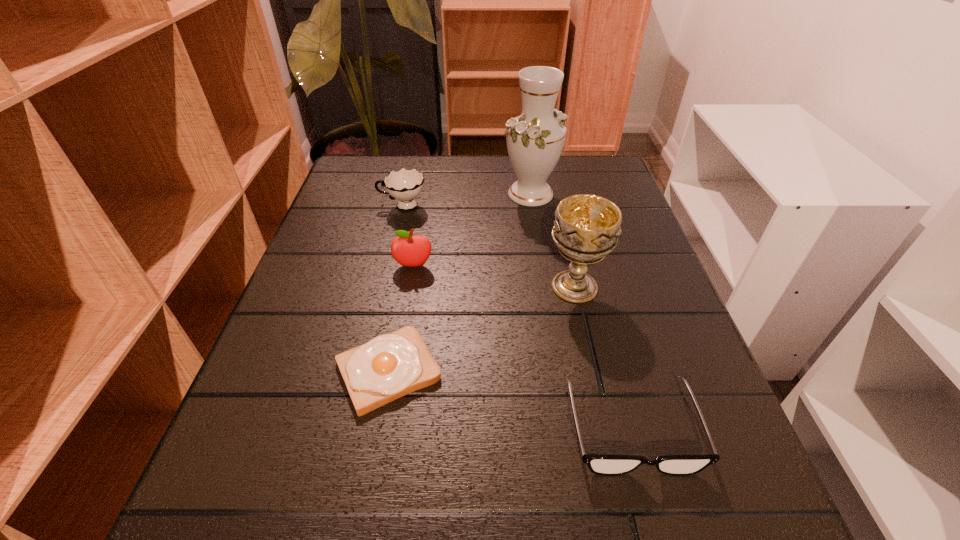
Locate an element on the screen. This screenshot has height=540, width=960. object situated at the far left corner is located at coordinates (405, 185).

Locate an element on the screen. The height and width of the screenshot is (540, 960). object located at the far right corner is located at coordinates (535, 139).

The height and width of the screenshot is (540, 960). In the image, there is a desktop. In order to click on free space at the far edge in this screenshot , I will do `click(507, 171)`.

Identify the location of free space at the near edge of the desktop. (505, 513).

Locate an element on the screen. The width and height of the screenshot is (960, 540). free location at the left edge is located at coordinates [x=339, y=323].

This screenshot has width=960, height=540. I want to click on vacant space at the right edge of the desktop, so click(x=718, y=406).

Identify the location of free location at the far left corner of the desktop. (370, 166).

This screenshot has width=960, height=540. Find the location of `vacant region at the far right corner of the desktop`. vacant region at the far right corner of the desktop is located at coordinates point(573,157).

Find the location of a particular element. free space between the vase and the shortest object is located at coordinates (460, 282).

The height and width of the screenshot is (540, 960). Identify the location of vacant point located between the vase and the apple. (472, 230).